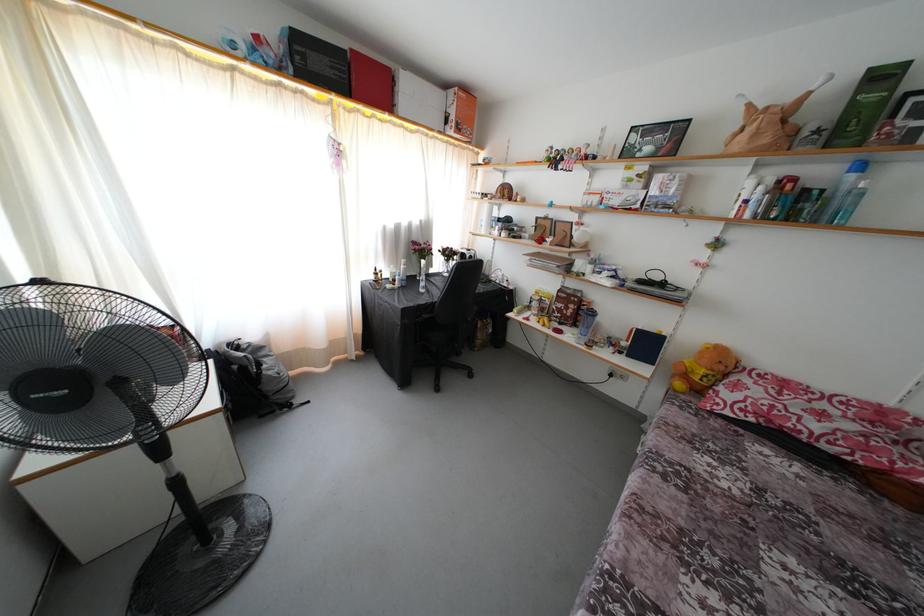
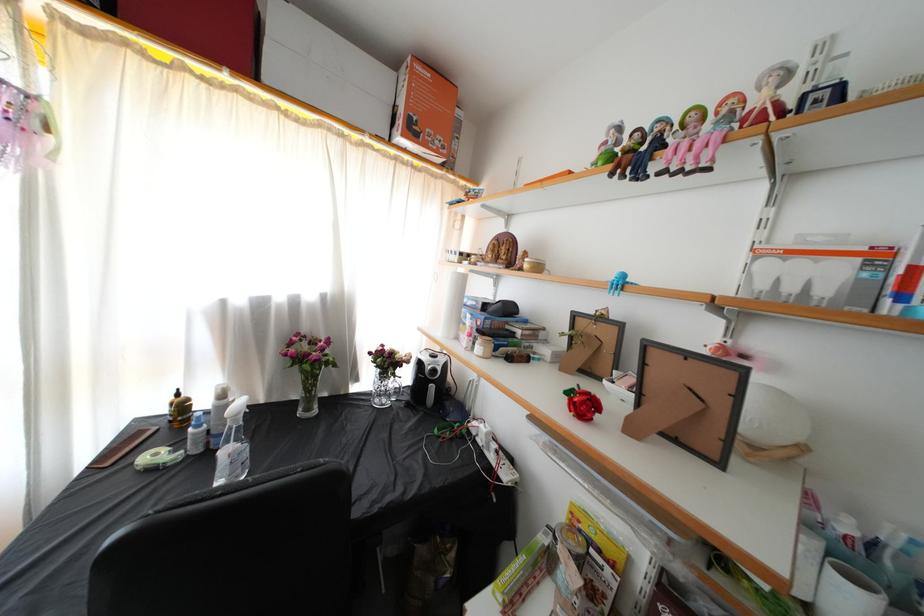
In the second image, find the point that corresponds to the point at 565,172 in the first image.

(659, 172)